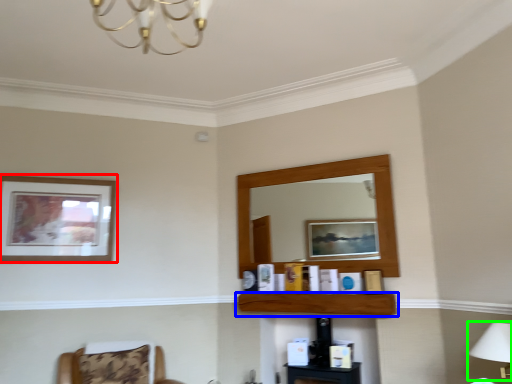
Question: Which object is the farthest from picture frame (highlighted by a red box)? Choose among these: shelf (highlighted by a blue box) or table lamp (highlighted by a green box).

Choices:
 (A) shelf
 (B) table lamp

Answer: (B)